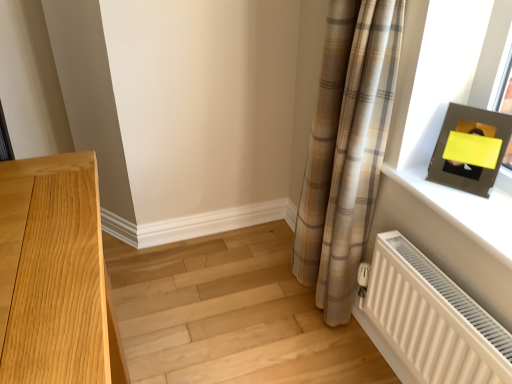
Describe the element at coordinates (230, 315) in the screenshot. I see `light wood floor at lower left` at that location.

The height and width of the screenshot is (384, 512). I want to click on matte black picture frame at upper right, so [x=469, y=134].

Does point (347, 67) come in front of point (482, 189)?

That is False.

From the image's perspective, does plaid fabric curtain at right appear higher than matte black picture frame at upper right?

Incorrect, from the image's perspective, plaid fabric curtain at right is lower than matte black picture frame at upper right.

Which of these two, plaid fabric curtain at right or matte black picture frame at upper right, is bigger?

Bigger between the two is plaid fabric curtain at right.

From a real-world perspective, which is physically below, plaid fabric curtain at right or matte black picture frame at upper right?

From a 3D spatial view, plaid fabric curtain at right is below.

From a real-world perspective, is light wood floor at lower left positioned over matte black picture frame at upper right based on gravity?

No, from a real-world perspective, light wood floor at lower left is not on top of matte black picture frame at upper right.

From the image's perspective, is light wood floor at lower left below matte black picture frame at upper right?

Result: Indeed, from the image's perspective, light wood floor at lower left is shown beneath matte black picture frame at upper right.

Is light wood floor at lower left aimed at white ribbed radiator at lower right?

No, light wood floor at lower left does not turn towards white ribbed radiator at lower right.

Which object is closer to the camera, light wood floor at lower left or white ribbed radiator at lower right?

white ribbed radiator at lower right.

From a real-world perspective, does light wood floor at lower left sit lower than white ribbed radiator at lower right?

Indeed, from a real-world perspective, light wood floor at lower left is positioned beneath white ribbed radiator at lower right.

Which is more distant, [337,349] or [504,372]?

The point [337,349] is behind.

Considering the sizes of objects white ribbed radiator at lower right and light wood floor at lower left in the image provided, who is bigger, white ribbed radiator at lower right or light wood floor at lower left?

light wood floor at lower left.

Is white ribbed radiator at lower right closer to the viewer compared to light wood floor at lower left?

Yes, white ribbed radiator at lower right is closer to the viewer.

The image size is (512, 384). Find the location of `radiator that appears above the light wood floor at lower left (from a real-world perspective)`. radiator that appears above the light wood floor at lower left (from a real-world perspective) is located at coordinates (430, 320).

Considering the sizes of objects white ribbed radiator at lower right and matte black frame at upper right in the image provided, who is smaller, white ribbed radiator at lower right or matte black frame at upper right?

matte black frame at upper right is smaller.

Which object is positioned more to the right, white ribbed radiator at lower right or matte black frame at upper right?

From the viewer's perspective, matte black frame at upper right appears more on the right side.

Could you tell me if white ribbed radiator at lower right is facing matte black frame at upper right?

No, white ribbed radiator at lower right does not turn towards matte black frame at upper right.

Is plaid fabric curtain at right thinner than matte black frame at upper right?

Yes.

From a real-world perspective, between plaid fabric curtain at right and matte black frame at upper right, who is vertically lower?

In real-world perspective, plaid fabric curtain at right is lower.

Considering the relative sizes of plaid fabric curtain at right and matte black frame at upper right in the image provided, is plaid fabric curtain at right shorter than matte black frame at upper right?

In fact, plaid fabric curtain at right may be taller than matte black frame at upper right.

Identify the location of curtain above the light wood floor at lower left (from the image's perspective). (346, 148).

From the image's perspective, which one is positioned lower, plaid fabric curtain at right or light wood floor at lower left?

From the image's view, light wood floor at lower left is below.

Can you tell me how much plaid fabric curtain at right and light wood floor at lower left differ in facing direction?

plaid fabric curtain at right and light wood floor at lower left are facing 92.9 degrees away from each other.

Does plaid fabric curtain at right have a greater width compared to light wood floor at lower left?

No, plaid fabric curtain at right is not wider than light wood floor at lower left.

I want to click on curtain located below the matte black picture frame at upper right (from the image's perspective), so click(346, 148).

This screenshot has width=512, height=384. What are the coordinates of `stairwell below the matte black picture frame at upper right (from a real-world perspective)` in the screenshot? It's located at [230, 315].

Estimate the real-world distances between objects in this image. Which object is further from white ribbed radiator at lower right, plaid fabric curtain at right or matte black picture frame at upper right?

Based on the image, matte black picture frame at upper right appears to be further to white ribbed radiator at lower right.

When comparing their distances from matte black picture frame at upper right, does white ribbed radiator at lower right or plaid fabric curtain at right seem further?

white ribbed radiator at lower right.

Looking at the image, which one is located further to matte black picture frame at upper right, plaid fabric curtain at right or light wood floor at lower left?

light wood floor at lower left is positioned further to the anchor matte black picture frame at upper right.

Looking at the image, which one is located further to matte black frame at upper right, white ribbed radiator at lower right or matte black picture frame at upper right?

white ribbed radiator at lower right.

Looking at the image, which one is located further to white ribbed radiator at lower right, plaid fabric curtain at right or matte black frame at upper right?

plaid fabric curtain at right is further to white ribbed radiator at lower right.

Based on their spatial positions, is matte black picture frame at upper right or light wood floor at lower left closer to plaid fabric curtain at right?

matte black picture frame at upper right lies closer to plaid fabric curtain at right than the other object.

Based on their spatial positions, is matte black picture frame at upper right or matte black frame at upper right further from white ribbed radiator at lower right?

matte black picture frame at upper right lies further to white ribbed radiator at lower right than the other object.

Looking at this image, estimate the real-world distances between objects in this image. Which object is closer to matte black picture frame at upper right, light wood floor at lower left or matte black frame at upper right?

matte black frame at upper right lies closer to matte black picture frame at upper right than the other object.

Find the location of `radiator between light wood floor at lower left and matte black frame at upper right from left to right`. radiator between light wood floor at lower left and matte black frame at upper right from left to right is located at coordinates (430, 320).

Identify the location of window sill that lies between plaid fabric curtain at right and white ribbed radiator at lower right from top to bottom. (463, 210).

Find the location of a particular element. The width and height of the screenshot is (512, 384). curtain between light wood floor at lower left and matte black frame at upper right in the horizontal direction is located at coordinates (346, 148).

The width and height of the screenshot is (512, 384). In order to click on window sill situated between plaid fabric curtain at right and matte black picture frame at upper right from left to right in this screenshot , I will do `click(463, 210)`.